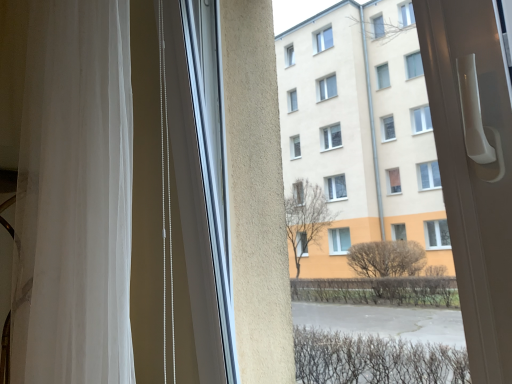
Image resolution: width=512 pixels, height=384 pixels. I want to click on white sheer curtain at left, so click(x=74, y=197).

The image size is (512, 384). What do you see at coordinates (74, 197) in the screenshot? I see `white sheer curtain at left` at bounding box center [74, 197].

Locate an element on the screen. The image size is (512, 384). white sheer curtain at left is located at coordinates (74, 197).